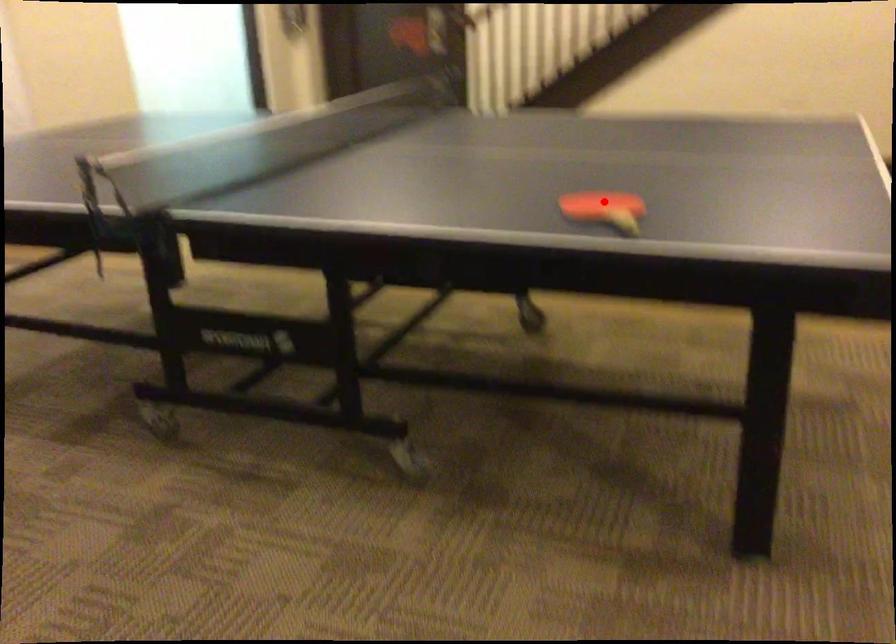
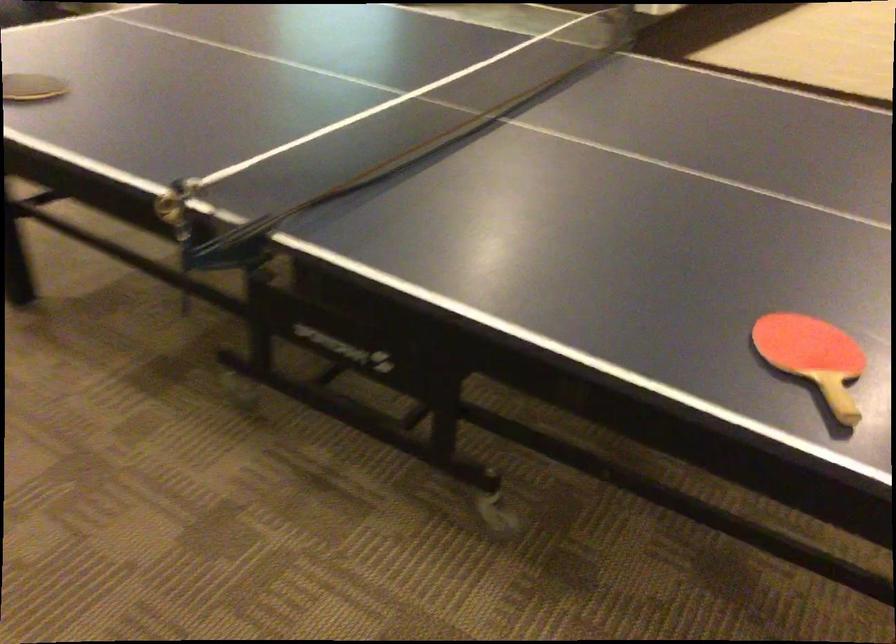
Question: I am providing you with two images of the same scene from different viewpoints. Image1 has a red point marked. In image2, the corresponding 3D location appears at what relative position? Reply with the corresponding letter.

Choices:
 (A) Closer
 (B) Farther

Answer: (A)